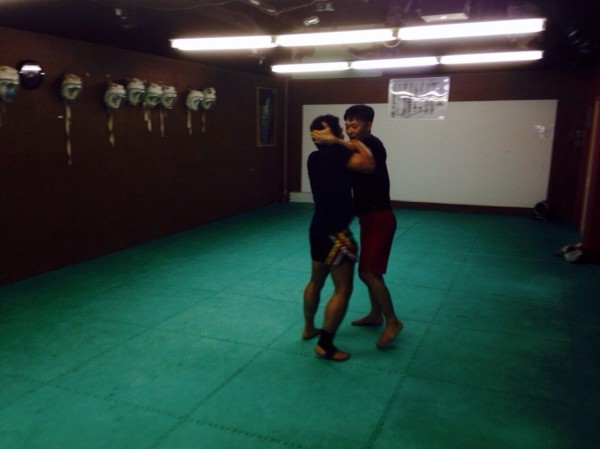
This screenshot has width=600, height=449. Identify the location of ceiling. (347, 11).